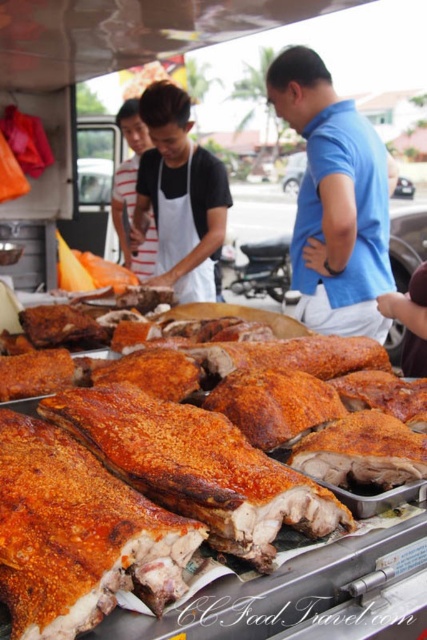
Is blue cotton shirt at center wider than golden crispy roasted pork at center?

Correct, the width of blue cotton shirt at center exceeds that of golden crispy roasted pork at center.

Is point (297, 202) farther from camera compared to point (201, 317)?

Yes, point (297, 202) is farther from viewer.

Measure the distance between blue cotton shirt at center and camera.

A distance of 2.17 meters exists between blue cotton shirt at center and camera.

This screenshot has width=427, height=640. What are the coordinates of `blue cotton shirt at center` in the screenshot? It's located at (335, 200).

From the picture: Is blue cotton shirt at center positioned in front of white fabric apron at center?

Yes, it is in front of white fabric apron at center.

Is point (386, 208) behind point (145, 157)?

No, it is not.

Which is in front, point (304, 216) or point (192, 161)?

Point (304, 216) is more forward.

Locate an element on the screen. The width and height of the screenshot is (427, 640). blue cotton shirt at center is located at coordinates (335, 200).

Locate an element on the screen. white apron at center is located at coordinates (180, 196).

Can you confirm if white apron at center is bigger than golden crispy roasted pork at center?

Correct, white apron at center is larger in size than golden crispy roasted pork at center.

Who is more distant from viewer, (145, 192) or (8, 300)?

Positioned behind is point (145, 192).

I want to click on white apron at center, so click(x=180, y=196).